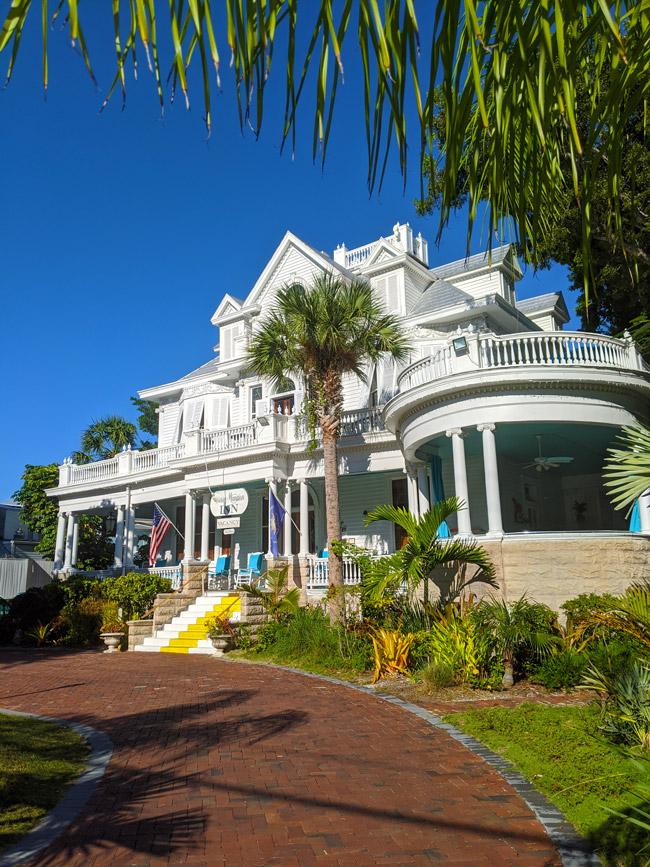
You are a GUI agent. You are given a task and a screenshot of the screen. Output one action in this format:
    pyautogui.click(x=<x>, y=<y>)
    Task: Click on the planter on left of steps
    The image size is (650, 867).
    Given the screenshot: What is the action you would take?
    pyautogui.click(x=114, y=635), pyautogui.click(x=112, y=642)